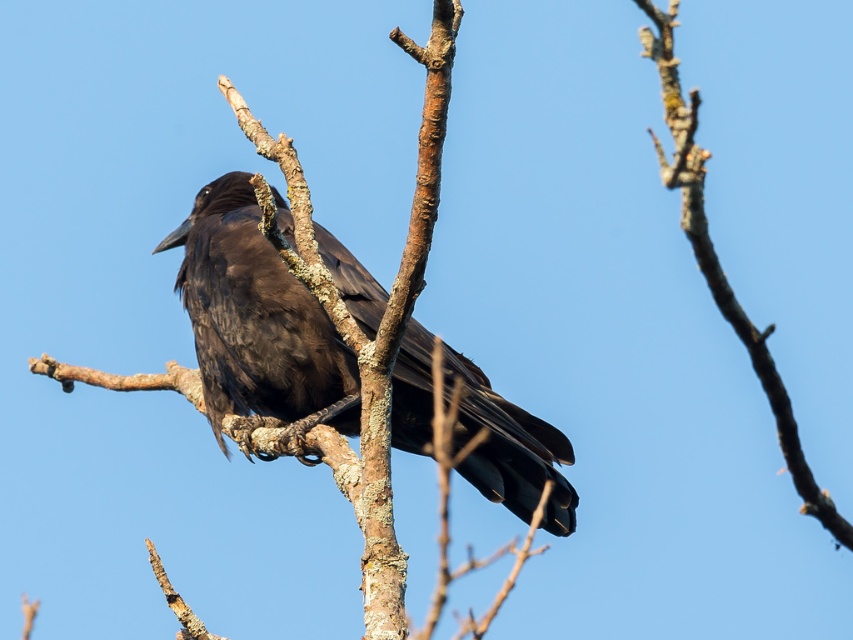
Question: Is shiny black raven at center behind smooth bark branch at upper center?

Choices:
 (A) no
 (B) yes

Answer: (B)

Question: Which object is closer to the camera taking this photo?

Choices:
 (A) shiny black raven at center
 (B) smooth bark branch at upper center

Answer: (B)

Question: Is shiny black raven at center above smooth bark branch at upper center?

Choices:
 (A) yes
 (B) no

Answer: (B)

Question: Among these objects, which one is farthest from the camera?

Choices:
 (A) shiny black raven at center
 (B) smooth bark branch at upper center

Answer: (A)

Question: Is shiny black raven at center to the right of smooth bark branch at upper center from the viewer's perspective?

Choices:
 (A) yes
 (B) no

Answer: (B)